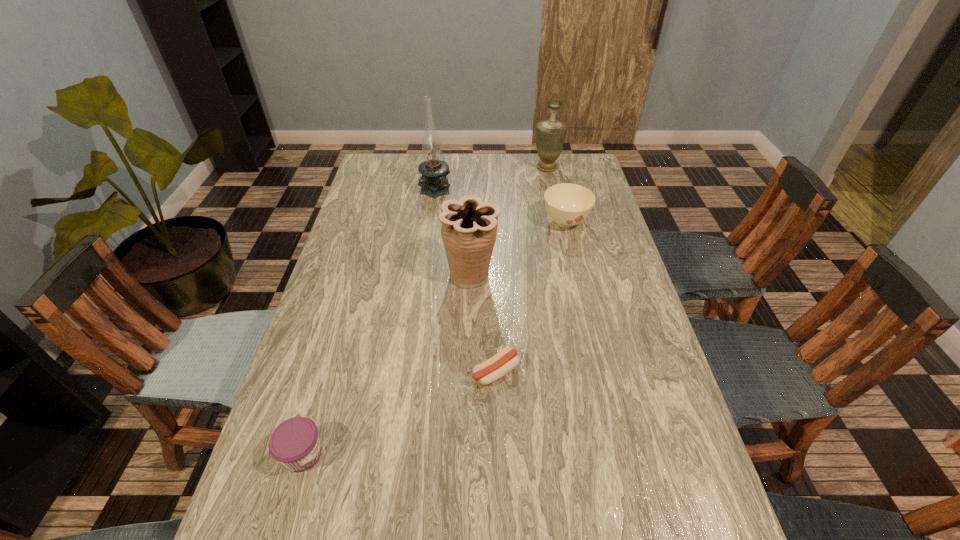
The image size is (960, 540). What are the coordinates of `the tallest object` in the screenshot? It's located at (434, 183).

Locate an element on the screen. the second farthest object is located at coordinates (434, 183).

Identify the location of the farther urn. (550, 134).

You are a GUI agent. You are given a task and a screenshot of the screen. Output one action in this format:
    pyautogui.click(x=<x>, y=<y>)
    Task: Click on the farthest object
    The height and width of the screenshot is (540, 960).
    Given the screenshot: What is the action you would take?
    pyautogui.click(x=550, y=134)

Where is `the left urn`? The height and width of the screenshot is (540, 960). the left urn is located at coordinates (469, 226).

Where is `the nearer urn`? the nearer urn is located at coordinates (469, 226).

The height and width of the screenshot is (540, 960). I want to click on the third shortest object, so click(567, 204).

Identify the location of sugar bowl. This screenshot has width=960, height=540. (567, 204).

The height and width of the screenshot is (540, 960). I want to click on the leftmost object, so click(x=295, y=443).

I want to click on the nearest object, so click(x=295, y=443).